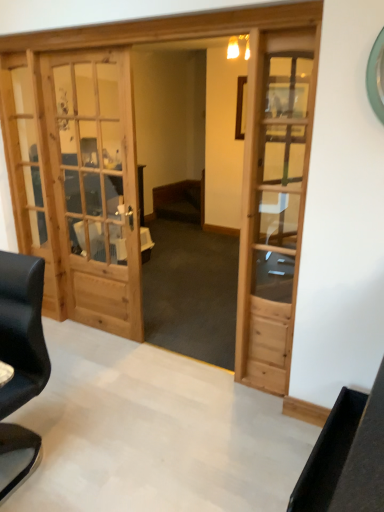
Question: Are black leather chair at left and light brown wooden door at center far apart?

Choices:
 (A) yes
 (B) no

Answer: (A)

Question: Can we say black leather chair at left lies outside light brown wooden door at center?

Choices:
 (A) no
 (B) yes

Answer: (B)

Question: Does black leather chair at left have a lesser width compared to light brown wooden door at center?

Choices:
 (A) yes
 (B) no

Answer: (B)

Question: From the image's perspective, is black leather chair at left on top of light brown wooden door at center?

Choices:
 (A) no
 (B) yes

Answer: (A)

Question: Considering the relative sizes of black leather chair at left and light brown wooden door at center in the image provided, is black leather chair at left smaller than light brown wooden door at center?

Choices:
 (A) no
 (B) yes

Answer: (A)

Question: Is light brown wooden door at center at the back of black leather chair at left?

Choices:
 (A) no
 (B) yes

Answer: (A)

Question: Does light brown wooden door at center turn towards black leather chair at left?

Choices:
 (A) yes
 (B) no

Answer: (B)

Question: Is light brown wooden door at center positioned beyond the bounds of black leather chair at left?

Choices:
 (A) no
 (B) yes

Answer: (B)

Question: Is black leather chair at left located within light brown wooden door at center?

Choices:
 (A) no
 (B) yes

Answer: (A)

Question: Can you confirm if light brown wooden door at center is thinner than black leather chair at left?

Choices:
 (A) no
 (B) yes

Answer: (B)

Question: From a real-world perspective, is light brown wooden door at center below black leather chair at left?

Choices:
 (A) no
 (B) yes

Answer: (A)

Question: Is light brown wooden door at center smaller than black leather chair at left?

Choices:
 (A) yes
 (B) no

Answer: (A)

Question: Considering the relative sizes of wooden table at center and light brown wooden door at center in the image provided, is wooden table at center thinner than light brown wooden door at center?

Choices:
 (A) no
 (B) yes

Answer: (A)